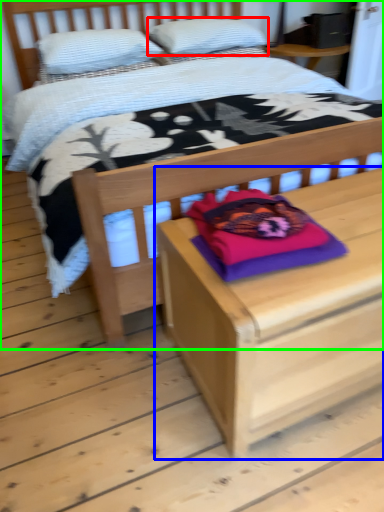
Question: Which object is positioned closest to pillow (highlighted by a red box)? Select from nightstand (highlighted by a blue box) and bed (highlighted by a green box).

Choices:
 (A) nightstand
 (B) bed

Answer: (B)